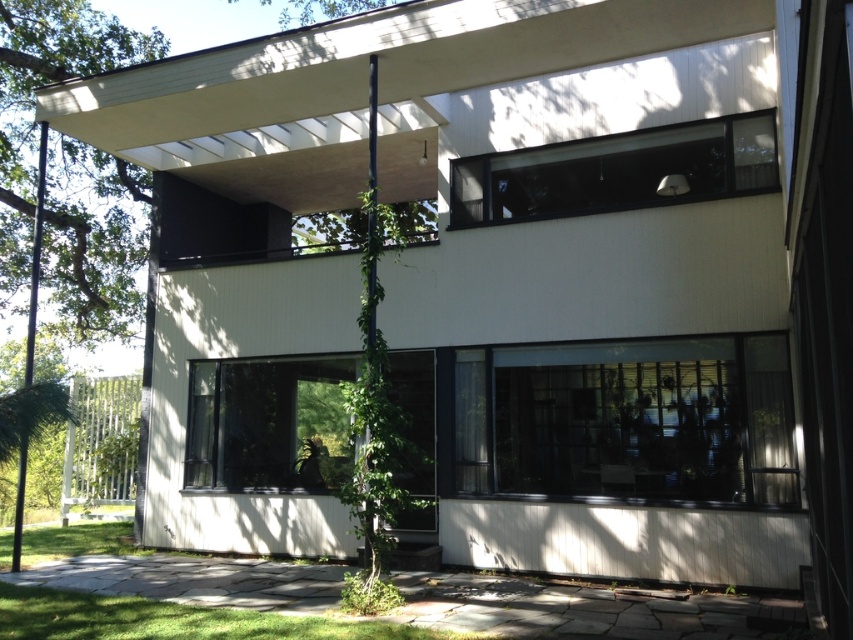
You are standing at the front entrance of the house and looking towards the green leafy tree at left and the green leafy tree at upper center. Which tree appears closer to you based on their positions?

The green leafy tree at left appears closer to you because it is positioned below the green leafy tree at upper center, indicating it is nearer in the scene.

You are a landscape architect designing a garden around the modern house. You need to place a new bench between the green leafy tree at left and the green leafy tree at upper center. Which tree should the bench be closer to to ensure it is under the larger tree for shade?

The bench should be placed closer to the green leafy tree at left since it has a larger width, providing more shade coverage than the green leafy tree at upper center.